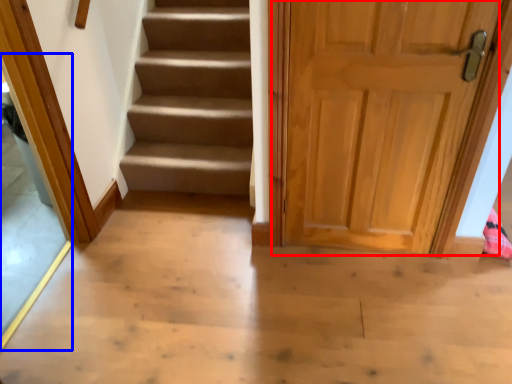
Question: Among these objects, which one is nearest to the camera, door (highlighted by a red box) or glass door (highlighted by a blue box)?

Choices:
 (A) door
 (B) glass door

Answer: (B)